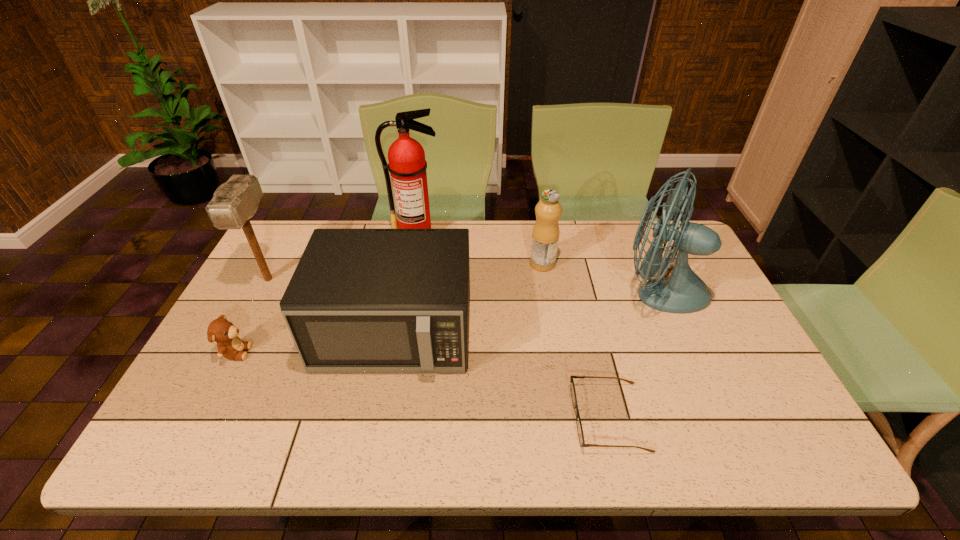
The width and height of the screenshot is (960, 540). I want to click on free space between the fruit juice and the spectacles, so click(575, 340).

Locate which object ranks second in proximity to the fire extinguisher. Please provide its 2D coordinates. Your answer should be formatted as a tuple, i.e. [(x, y)], where the tuple contains the x and y coordinates of a point satisfying the conditions above.

[(545, 236)]

You are a GUI agent. You are given a task and a screenshot of the screen. Output one action in this format:
    pyautogui.click(x=<x>, y=<y>)
    Task: Click on the sixth closest object relative to the rightmost object
    
    Given the screenshot: What is the action you would take?
    pyautogui.click(x=236, y=201)

Locate an element on the screen. Image resolution: width=960 pixels, height=540 pixels. free space that satisfies the following two spatial constraints: 1. on the front-facing side of the microwave oven; 2. on the face of the second shortest object is located at coordinates (391, 353).

You are a GUI agent. You are given a task and a screenshot of the screen. Output one action in this format:
    pyautogui.click(x=<x>, y=<y>)
    Task: Click on the vacant space that satisfies the following two spatial constraints: 1. on the side of the fire extinguisher near the handle; 2. on the face of the second shortest object
    Image resolution: width=960 pixels, height=540 pixels.
    Given the screenshot: What is the action you would take?
    pyautogui.click(x=395, y=353)